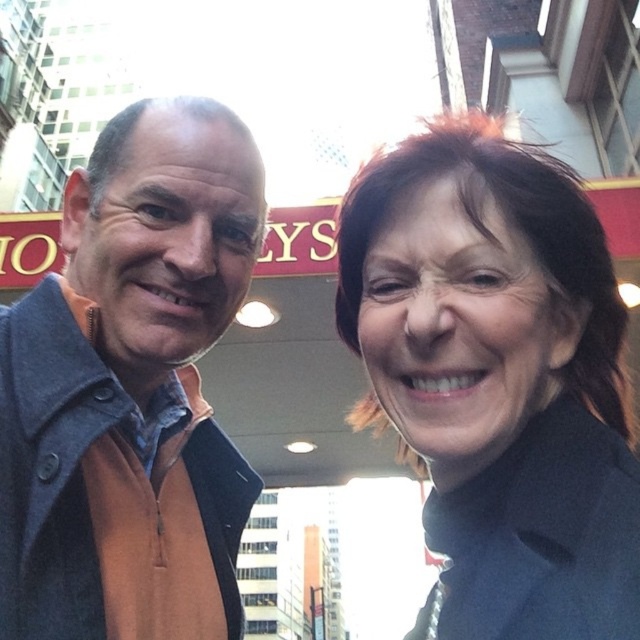
Does orange fleece at left have a smaller size compared to matte black coat at upper right?

Indeed, orange fleece at left has a smaller size compared to matte black coat at upper right.

Is orange fleece at left bigger than matte black coat at upper right?

No.

Between point (145, 272) and point (381, 323), which one is positioned behind?

Point (145, 272)

This screenshot has width=640, height=640. In order to click on orange fleece at left in this screenshot , I will do `click(131, 388)`.